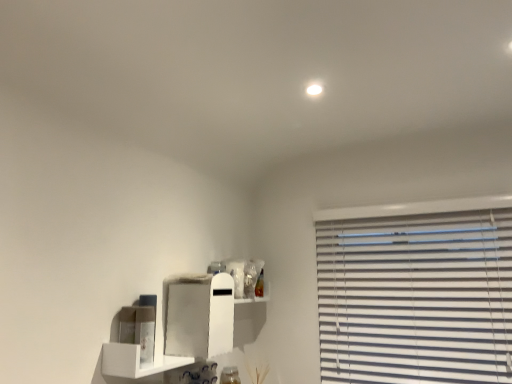
Question: Is white matte cabinet at center outside white matte shelf at lower left?

Choices:
 (A) yes
 (B) no

Answer: (A)

Question: Does white matte cabinet at center have a lesser height compared to white matte shelf at lower left?

Choices:
 (A) yes
 (B) no

Answer: (B)

Question: Is white matte cabinet at center in contact with white matte shelf at lower left?

Choices:
 (A) yes
 (B) no

Answer: (B)

Question: Does white matte cabinet at center contain white matte shelf at lower left?

Choices:
 (A) yes
 (B) no

Answer: (A)

Question: From a real-world perspective, is white matte cabinet at center under white matte shelf at lower left?

Choices:
 (A) no
 (B) yes

Answer: (A)

Question: Does white matte cabinet at center have a smaller size compared to white matte shelf at lower left?

Choices:
 (A) no
 (B) yes

Answer: (A)

Question: Is white matte shelf at lower left smaller than white matte cabinet at center?

Choices:
 (A) no
 (B) yes

Answer: (B)

Question: From the image's perspective, does white matte shelf at lower left appear higher than white matte cabinet at center?

Choices:
 (A) yes
 (B) no

Answer: (B)

Question: Is white matte shelf at lower left facing towards white matte cabinet at center?

Choices:
 (A) yes
 (B) no

Answer: (B)

Question: Can you confirm if white matte shelf at lower left is taller than white matte cabinet at center?

Choices:
 (A) yes
 (B) no

Answer: (B)

Question: Is white matte shelf at lower left directly adjacent to white matte cabinet at center?

Choices:
 (A) yes
 (B) no

Answer: (B)

Question: Would you say white matte shelf at lower left contains white matte cabinet at center?

Choices:
 (A) yes
 (B) no

Answer: (B)

Question: Is white matte shelf at lower left bigger or smaller than white matte cabinet at center?

Choices:
 (A) big
 (B) small

Answer: (B)